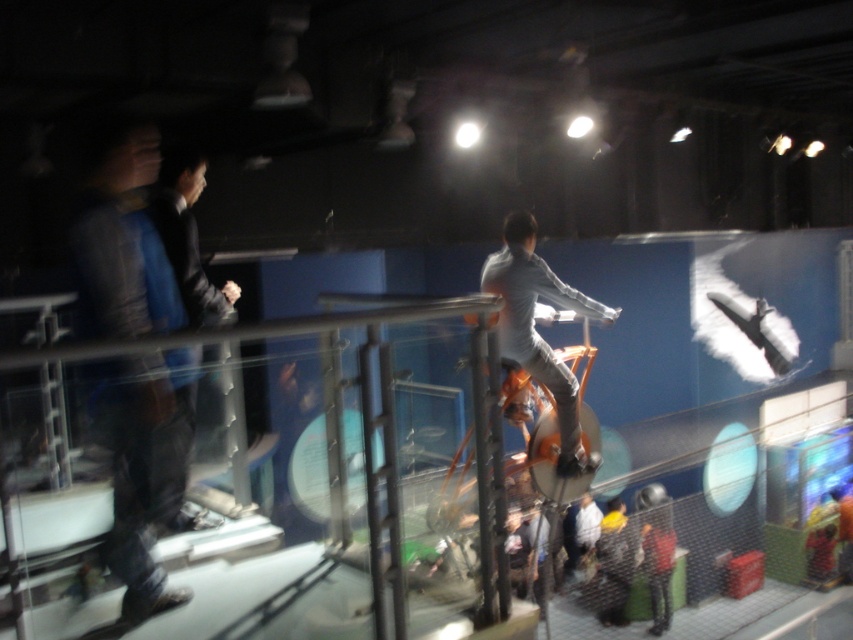
From the picture: You are a tour guide in the museum and want to move from the blue denim jeans at left to the red fabric jacket at lower right. What is the minimum distance you need to cover to reach there?

The minimum distance you need to cover to reach from the blue denim jeans at left to the red fabric jacket at lower right is 5.77 meters.

You are a security guard in the museum and need to monitor two visitors wearing blue denim jeans at left and dark blue suit at left. Which visitor is closer to the glass railing?

The blue denim jeans at left is in front of the dark blue suit at left, so the blue denim jeans at left is closer to the glass railing.

You are a security guard in the museum and need to ensure that both the blue denim jeans at left and dark blue suit at left are within the restricted area. Given their sizes, which one might require more space to accommodate?

The blue denim jeans at left has a larger size compared to dark blue suit at left, so it would require more space to accommodate.